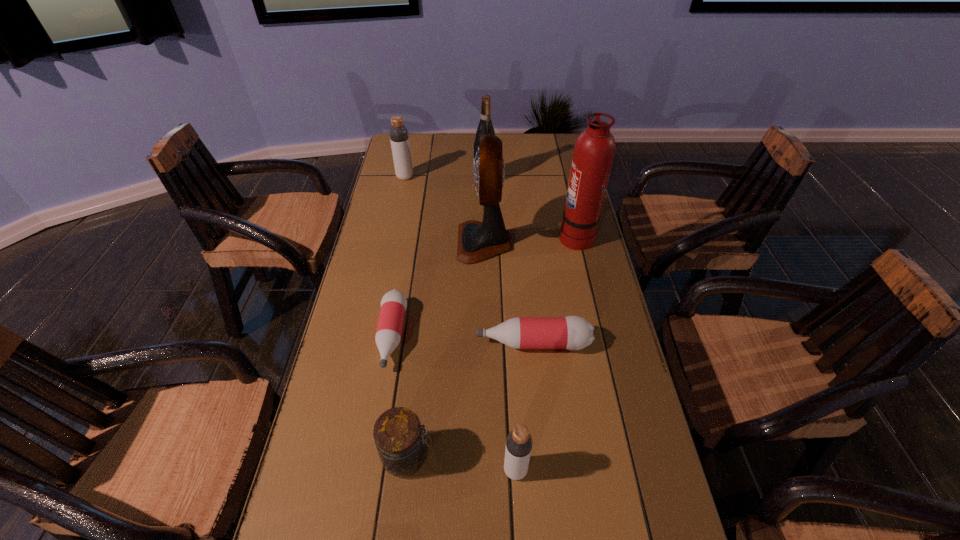
Identify the location of fire extinguisher. This screenshot has width=960, height=540. (594, 150).

Find the location of `brown fan`. brown fan is located at coordinates (477, 241).

The width and height of the screenshot is (960, 540). I want to click on wine bottle, so click(x=485, y=126).

Image resolution: width=960 pixels, height=540 pixels. Identify the location of the bigger gray bottle. (399, 137).

Identify the location of the farthest bottle. (399, 137).

At what (x,y) coordinates should I click in order to perform the action: click on the third shortest bottle. Please return your answer as a coordinate pair (x, y). The image size is (960, 540). Looking at the image, I should click on (519, 442).

Identify the location of the nearest bottle. (519, 442).

Locate an element on the screen. The image size is (960, 540). the sixth tallest object is located at coordinates (401, 444).

Find the location of a particular element. the second shortest object is located at coordinates (572, 332).

I want to click on the bigger pink bottle, so click(x=572, y=332).